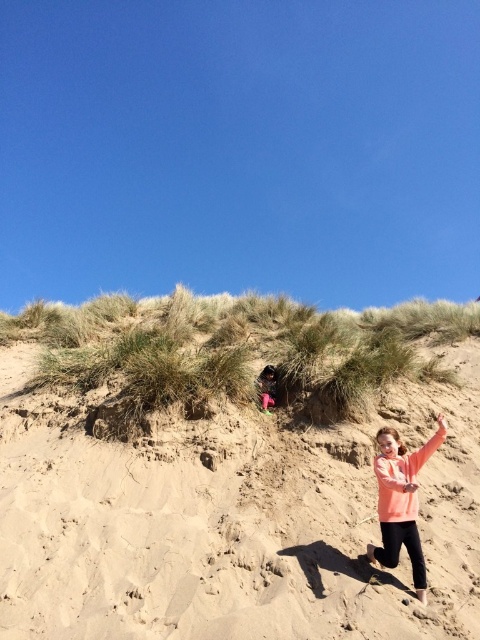
You are a photographer trying to capture a photo of the pink fabric at center and the green grassy hillside at upper center. Which object should you focus on first if you want to ensure both are in sharp focus?

The green grassy hillside at upper center is below the pink fabric at center, so focusing on the pink fabric at center first would ensure both are in focus as they are closer to the camera.